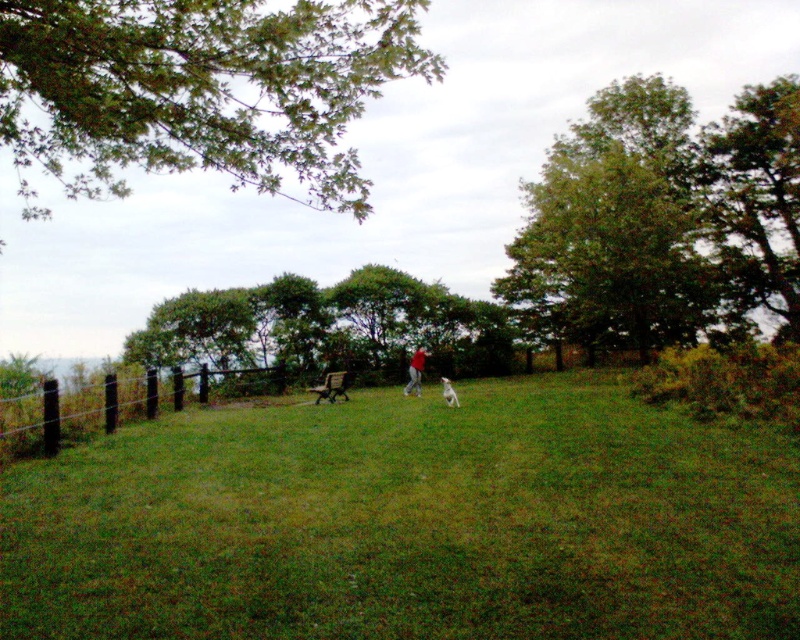
Can you confirm if red matte shirt at center is positioned to the left of white fluffy dog at center?

Yes, red matte shirt at center is to the left of white fluffy dog at center.

Who is positioned more to the left, red matte shirt at center or white fluffy dog at center?

red matte shirt at center

Is point (416, 387) positioned behind point (445, 401)?

Yes, it is.

Where is `red matte shirt at center`? Image resolution: width=800 pixels, height=640 pixels. red matte shirt at center is located at coordinates (416, 371).

Is green leafy tree at upper left behind brown wooden fence at left?

No.

The image size is (800, 640). I want to click on green leafy tree at upper left, so click(200, 90).

Does point (400, 49) come in front of point (17, 444)?

Yes, point (400, 49) is closer to viewer.

Where is `green leafy tree at upper left`? This screenshot has width=800, height=640. green leafy tree at upper left is located at coordinates (200, 90).

Does green grassy field at center have a lesser width compared to brown wooden fence at left?

No, green grassy field at center is not thinner than brown wooden fence at left.

Does green grassy field at center appear over brown wooden fence at left?

No, green grassy field at center is not above brown wooden fence at left.

Where is `green grassy field at center`? This screenshot has height=640, width=800. green grassy field at center is located at coordinates (410, 522).